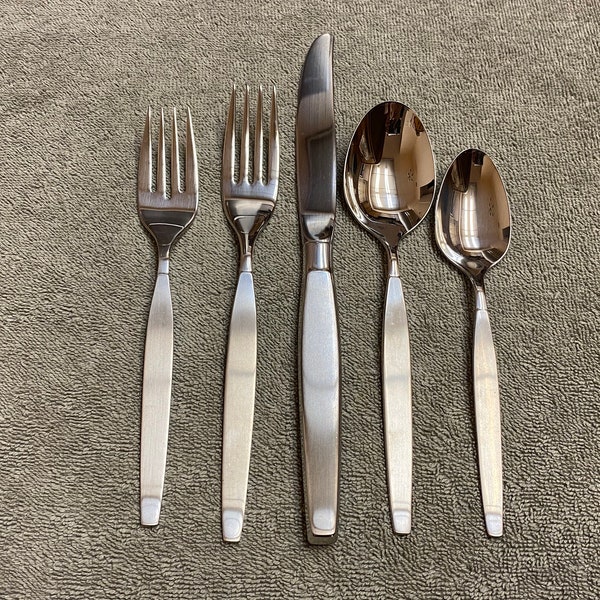
At what (x,y) coordinates should I click in order to perform the action: click on silverware. Please return your answer as a coordinate pair (x, y). The image size is (600, 600). Looking at the image, I should click on (154, 418), (237, 445), (317, 445), (393, 444), (489, 447).